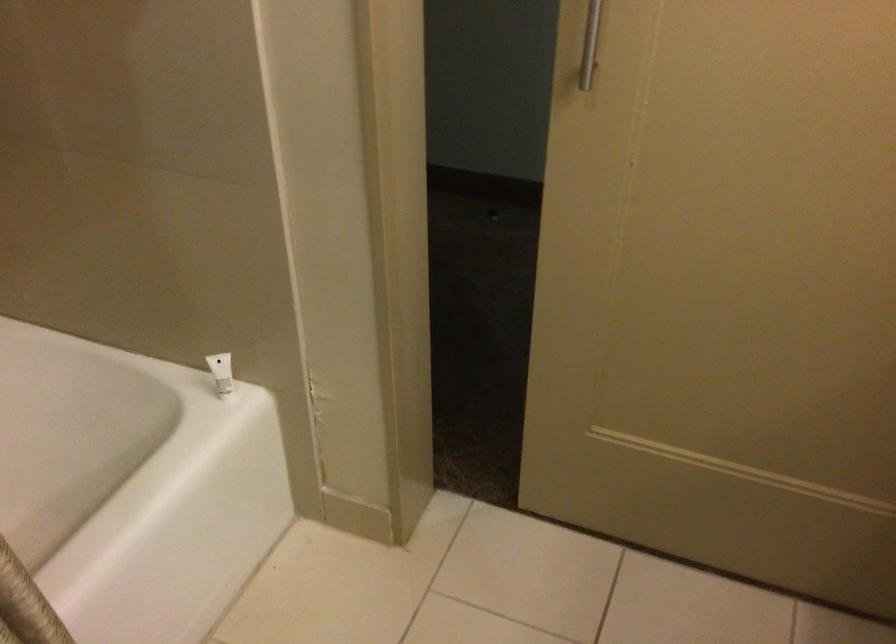
How did the camera likely rotate?

The camera rotated toward right-down.